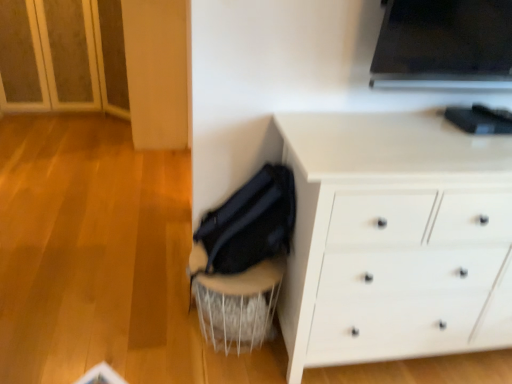
Question: Relative to velvet black swivel chair at lower center, is white matte chest of drawers at lower right in front or behind?

Choices:
 (A) front
 (B) behind

Answer: (A)

Question: From their relative heights in the image, would you say white matte chest of drawers at lower right is taller or shorter than velvet black swivel chair at lower center?

Choices:
 (A) short
 (B) tall

Answer: (B)

Question: From the image's perspective, is white matte chest of drawers at lower right positioned above or below velvet black swivel chair at lower center?

Choices:
 (A) above
 (B) below

Answer: (A)

Question: Is velvet black swivel chair at lower center wider or thinner than white matte chest of drawers at lower right?

Choices:
 (A) thin
 (B) wide

Answer: (A)

Question: Looking at the image, does velvet black swivel chair at lower center seem bigger or smaller compared to white matte chest of drawers at lower right?

Choices:
 (A) small
 (B) big

Answer: (A)

Question: In the image, is velvet black swivel chair at lower center positioned in front of or behind white matte chest of drawers at lower right?

Choices:
 (A) front
 (B) behind

Answer: (B)

Question: Is velvet black swivel chair at lower center taller or shorter than white matte chest of drawers at lower right?

Choices:
 (A) tall
 (B) short

Answer: (B)